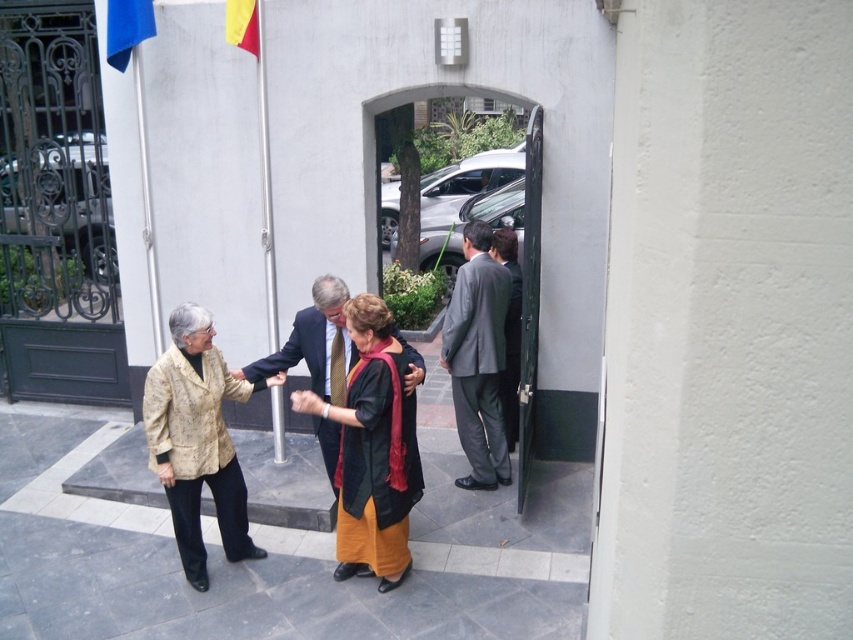
You are standing in front of the building and want to enter through the green matte door at center. There is a printed fabric jacket at left in your way. Which direction should you move to avoid it and reach the door?

Since the printed fabric jacket at left is to the left of the green matte door at center, you should move to the right to avoid it and reach the door.